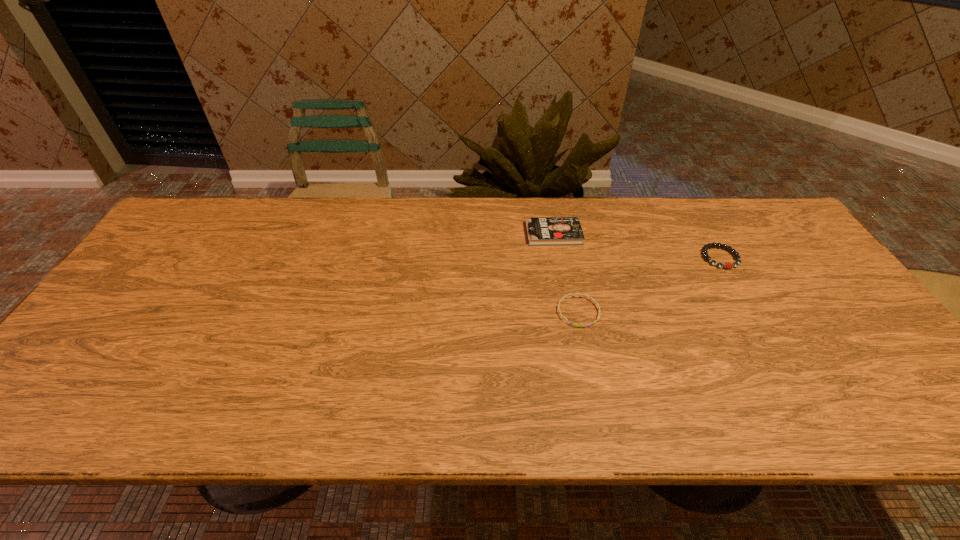
You are a GUI agent. You are given a task and a screenshot of the screen. Output one action in this format:
    pyautogui.click(x=<x>, y=<y>)
    Task: Click on the tallest object
    Image resolution: width=960 pixels, height=540 pixels.
    Given the screenshot: What is the action you would take?
    coord(541,231)

Where is `the rightmost object`? The width and height of the screenshot is (960, 540). the rightmost object is located at coordinates (705, 255).

Find the location of a particular element. The image size is (960, 540). the farther bracelet is located at coordinates (705, 255).

The height and width of the screenshot is (540, 960). I want to click on the nearer bracelet, so click(x=581, y=295).

The width and height of the screenshot is (960, 540). Find the location of `the left bracelet`. the left bracelet is located at coordinates (581, 295).

Identify the location of free space located 0.400m on the left of the tallest object. (395, 234).

Locate an element on the screen. Image resolution: width=960 pixels, height=540 pixels. free point located on the front of the right bracelet is located at coordinates (768, 343).

In order to click on vacant space located 0.240m on the surface of the left bracelet showing star-shaped elements in this screenshot , I will do `click(600, 420)`.

I want to click on book at the far edge, so click(x=541, y=231).

What are the coordinates of `bracelet located in the far edge section of the desktop` in the screenshot? It's located at (705, 255).